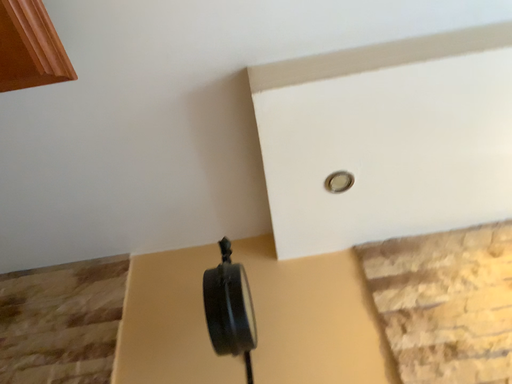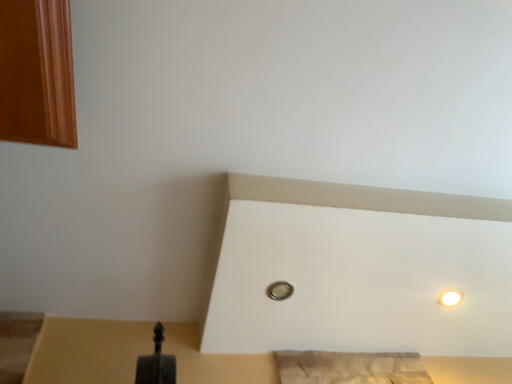
Question: How did the camera likely rotate when shooting the video?

Choices:
 (A) rotated downward
 (B) rotated upward

Answer: (B)